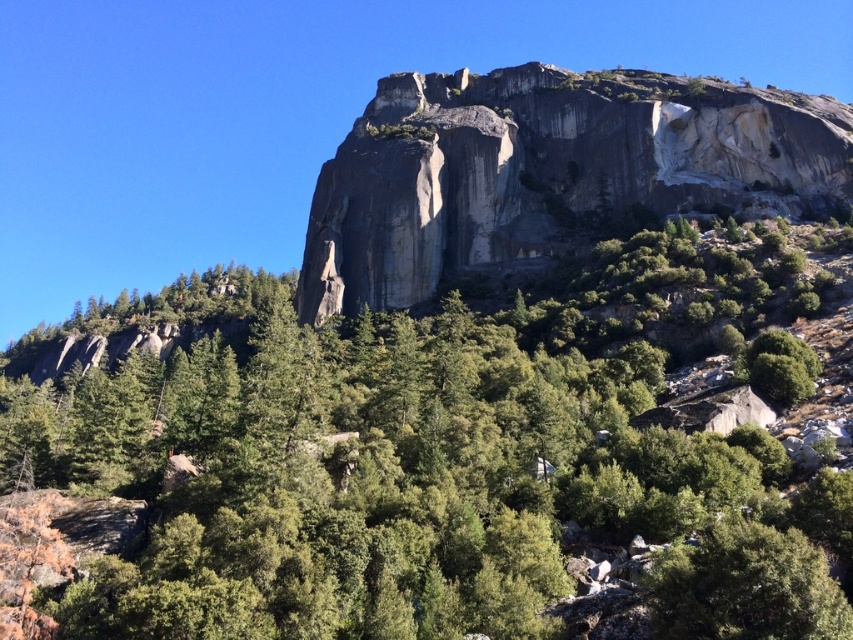
You are a hiker standing at the base of the gray rock formation at upper center and want to take a photo of the green leafy tree at center. Since you have a wide angle lens, which object should you focus on first to ensure both are in frame?

The green leafy tree at center is shorter than the gray rock formation at upper center, so you should focus on the gray rock formation at upper center first to ensure both are in frame.

You are an environmental scientist examining the landscape. You notice the green leafy tree at center and the gray rock formation at upper center. Which object is positioned to the right side of the other?

The gray rock formation at upper center is positioned to the right of the green leafy tree at center.

You are a hiker standing at the base of the gray rock formation at upper center and want to reach the green leafy tree at center. Which direction should you move to get closer to the tree?

To reach the green leafy tree at center from the gray rock formation at upper center, you should move downward since the tree is located at the center, which is lower than the rock formation positioned at the upper center.